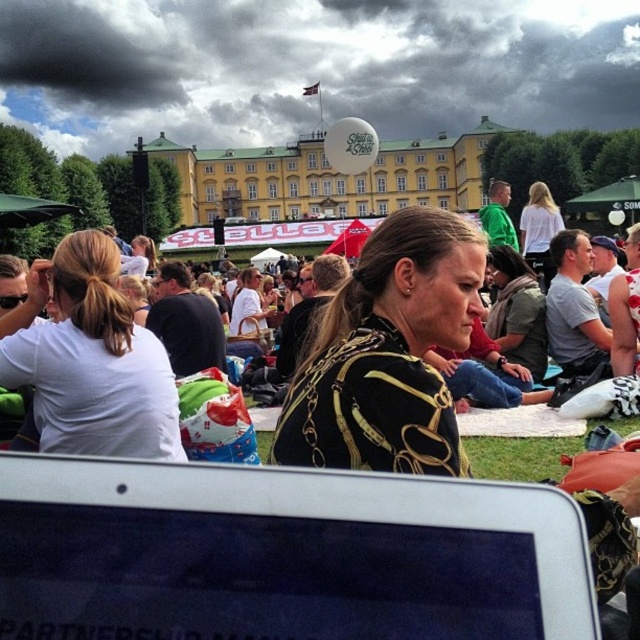
Is the position of silver metallic tablet at lower center less distant than that of black textured jacket at center?

Yes.

Is silver metallic tablet at lower center behind black textured jacket at center?

No, silver metallic tablet at lower center is in front of black textured jacket at center.

This screenshot has width=640, height=640. I want to click on silver metallic tablet at lower center, so click(282, 556).

Identify the location of silver metallic tablet at lower center. (282, 556).

Does black leather jacket at center appear on the right side of white matte shirt at upper right?

In fact, black leather jacket at center is to the left of white matte shirt at upper right.

Between point (529, 353) and point (545, 195), which one is positioned behind?

Positioned behind is point (545, 195).

The width and height of the screenshot is (640, 640). I want to click on black leather jacket at center, so click(x=516, y=310).

Between silver metallic tablet at lower center and black leather jacket at center, which one is positioned higher?

black leather jacket at center is above.

Measure the distance between point (337,618) and camera.

A distance of 156.66 feet exists between point (337,618) and camera.

Find the location of `silver metallic tablet at lower center`. silver metallic tablet at lower center is located at coordinates (282, 556).